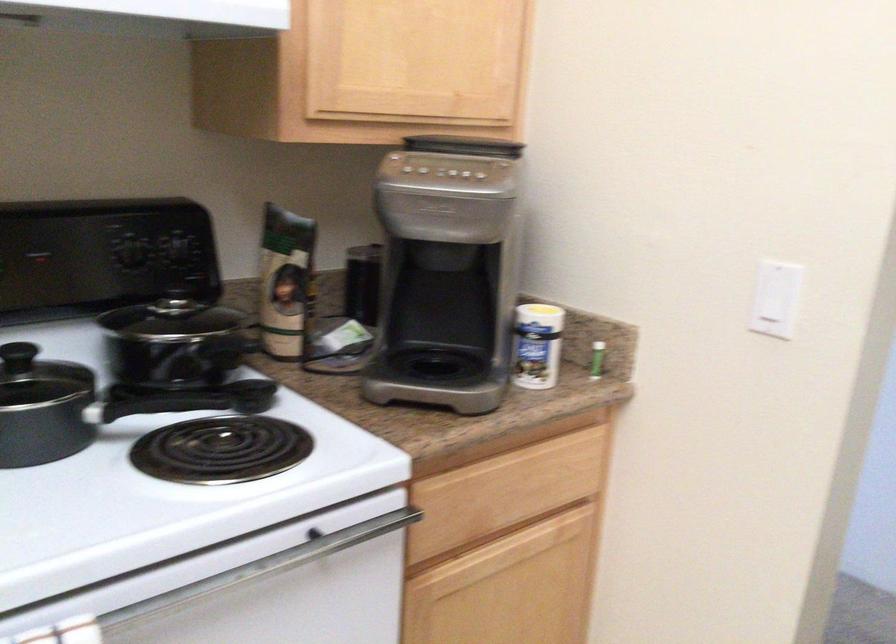
Based on the continuous images, in which direction is the camera rotating?

The camera's rotation is toward right-down.